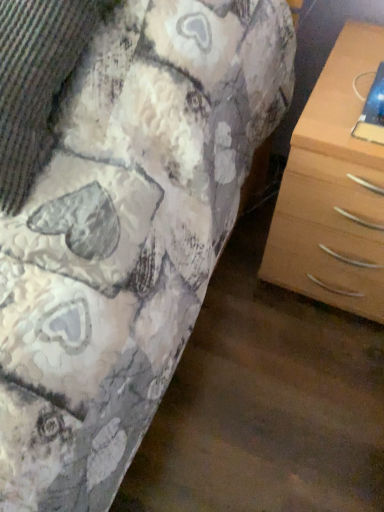
You are a GUI agent. You are given a task and a screenshot of the screen. Output one action in this format:
    pyautogui.click(x=<x>, y=<y>)
    Task: Click on the vacant area in front of light brown wooden chest of drawers at right
    
    Given the screenshot: What is the action you would take?
    [x=306, y=380]